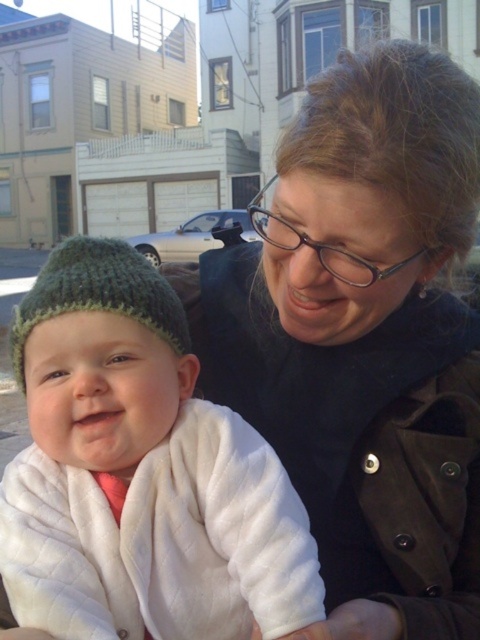
Question: Is matte black jacket at center above green knitted hat at left?

Choices:
 (A) no
 (B) yes

Answer: (A)

Question: Estimate the real-world distances between objects in this image. Which object is farther from the knitted green hat at left?

Choices:
 (A) green knitted hat at left
 (B) matte black jacket at center

Answer: (B)

Question: Does matte black jacket at center have a lesser width compared to knitted green hat at left?

Choices:
 (A) no
 (B) yes

Answer: (A)

Question: Which of the following is the farthest from the observer?

Choices:
 (A) knitted green hat at left
 (B) green knitted hat at left
 (C) matte black jacket at center

Answer: (B)

Question: Which point is closer to the camera?

Choices:
 (A) (74, 330)
 (B) (325, 253)
 (C) (180, 337)

Answer: (A)

Question: Where is matte black jacket at center located in relation to knitted green hat at left in the image?

Choices:
 (A) right
 (B) left

Answer: (A)